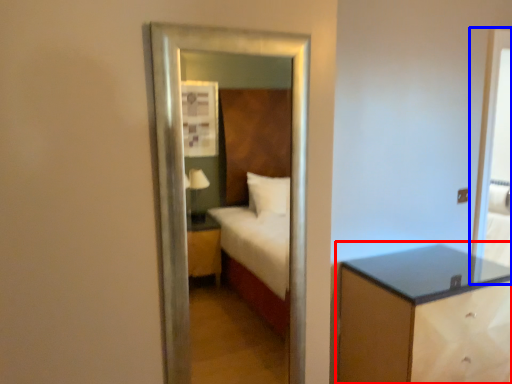
Question: Among these objects, which one is nearest to the camera, nightstand (highlighted by a red box) or screen door (highlighted by a blue box)?

Choices:
 (A) nightstand
 (B) screen door

Answer: (A)